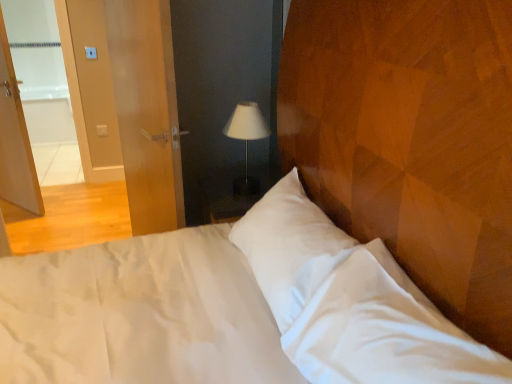
Where is `free area below white fabric lampshade at center (from a real-world perspective)`? free area below white fabric lampshade at center (from a real-world perspective) is located at coordinates (242, 190).